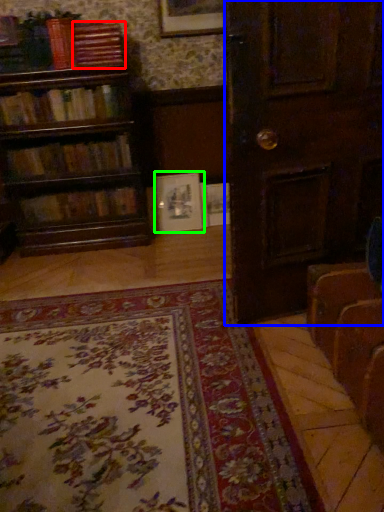
Question: Which is nearer to the book (highlighted by a red box)? door (highlighted by a blue box) or picture frame (highlighted by a green box).

Choices:
 (A) door
 (B) picture frame

Answer: (B)